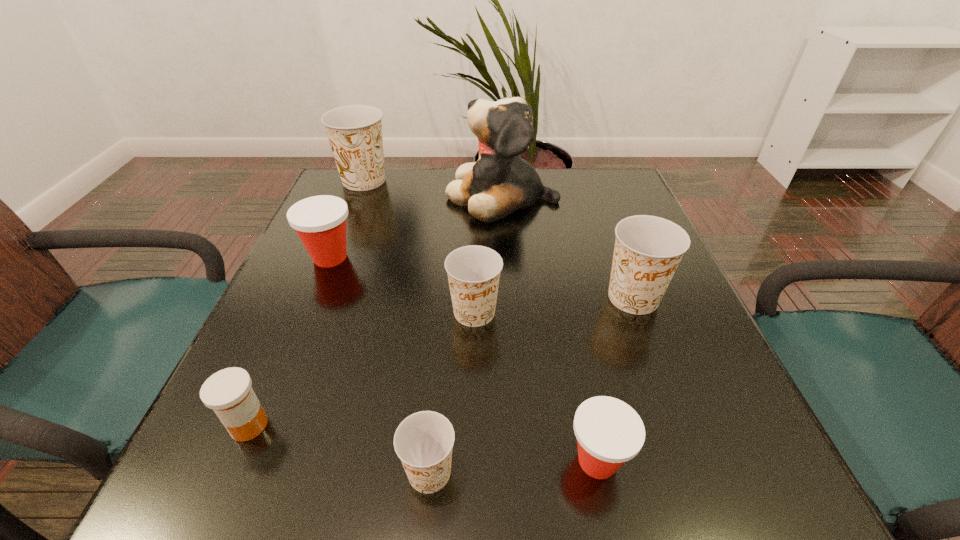
This screenshot has width=960, height=540. I want to click on the second Dixie cup from right to left, so click(x=609, y=432).

This screenshot has height=540, width=960. Find the location of `the nearest orange Dixie cup`. the nearest orange Dixie cup is located at coordinates tap(423, 441).

Where is `vacant space situated at the face of the tallest object`? The width and height of the screenshot is (960, 540). vacant space situated at the face of the tallest object is located at coordinates (366, 194).

In order to click on vacant space located at the face of the tallest object in this screenshot , I will do 354,194.

The image size is (960, 540). What are the coordinates of `free spot located 0.160m at the face of the tallest object` in the screenshot? It's located at (385, 194).

At what (x,y) coordinates should I click in order to perform the action: click on vacant space located on the front of the farthest Dixie cup. Please return your answer as a coordinate pair (x, y). The image size is (960, 540). Looking at the image, I should click on (348, 221).

I want to click on vacant space situated 0.110m on the left of the third tallest object, so click(544, 298).

In order to click on free space located 0.240m on the right of the fifth nearest Dixie cup in this screenshot , I will do `click(468, 258)`.

Locate an element on the screen. blank area located 0.310m on the left of the second smallest orange Dixie cup is located at coordinates (282, 312).

Find the location of `free space located 0.160m on the label of the orange medicine`. free space located 0.160m on the label of the orange medicine is located at coordinates (378, 425).